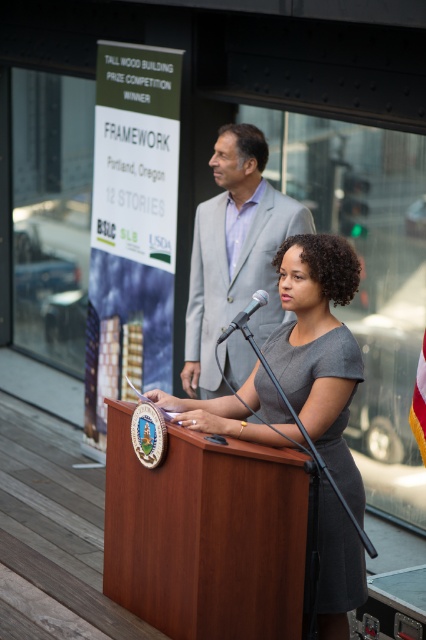
You are an event planner checking the setup. The microphone stand on the mahogany wood podium at center needs to be adjusted so the speaker in the gray matte dress at center can reach it comfortably. Which object should you adjust the microphone stand height relative to?

The mahogany wood podium at center is shorter than the gray matte dress at center, so you should adjust the microphone stand height to match the speaker in the gray matte dress at center.

You are attending a lecture and need to place a name tag on the podium. The name tag is small and must be placed on the mahogany wood podium at center. However, there is already a gray matte dress at center. Can you place the name tag on the podium without moving the dress?

The mahogany wood podium at center is located below the gray matte dress at center, so you can place the name tag on the podium since the dress is above it and not covering the surface.